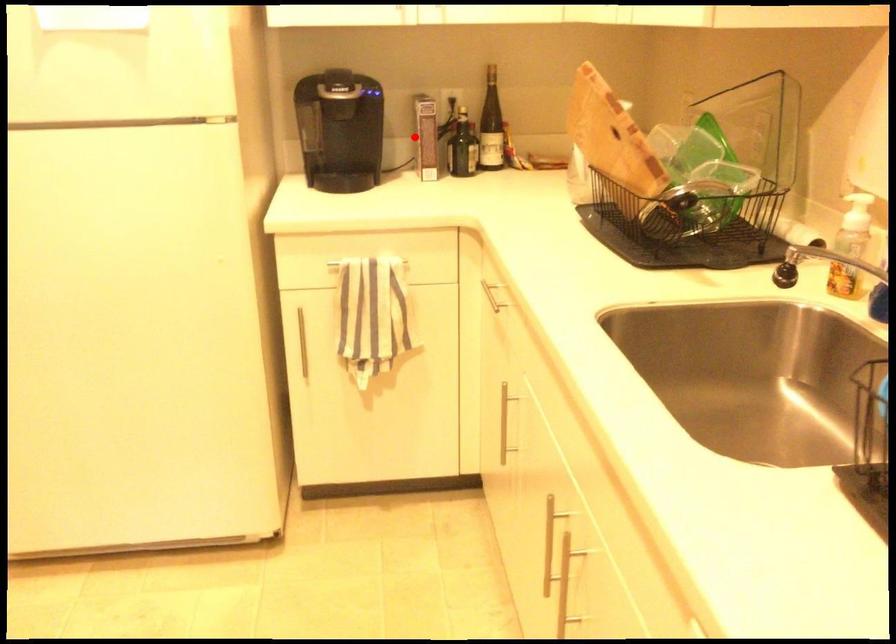
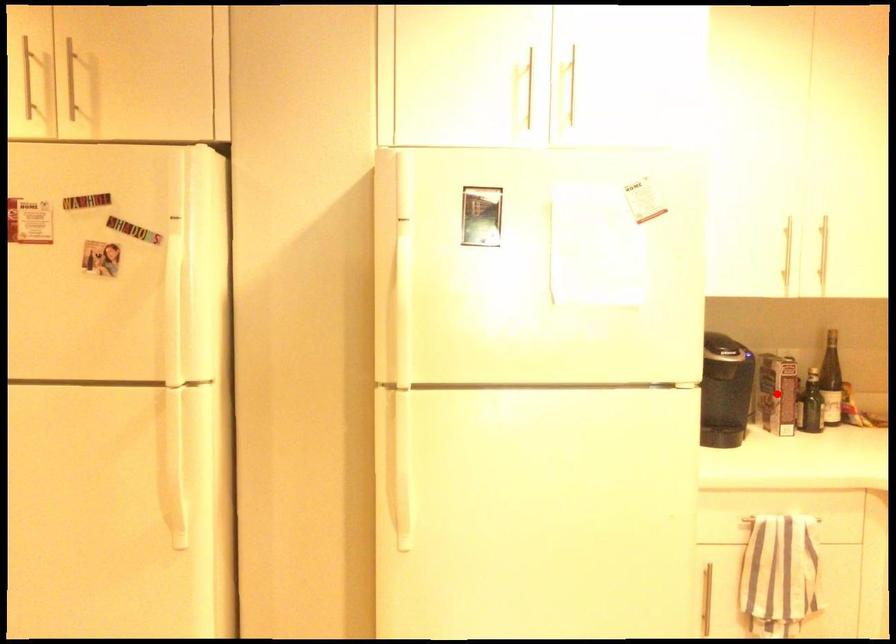
I am providing you with two images of the same scene from different viewpoints. A red point is marked on the first image and another point is marked on the second image. Are the points marked in image1 and image2 representing the same 3D position?

Yes